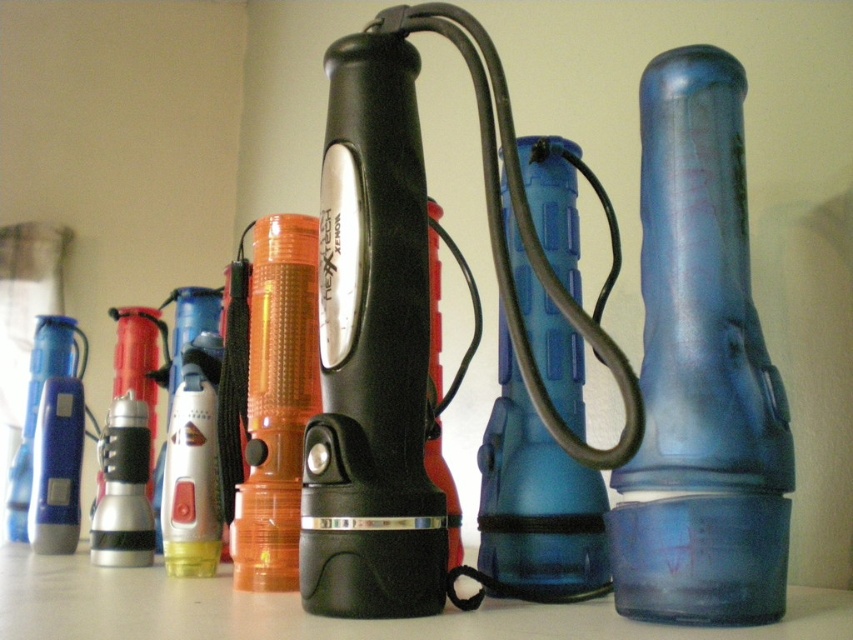
You are organizing a camping trip and need to choose between the transparent blue flashlight at right and the blue translucent bottle at center. Based on their sizes, which one would you pick for better visibility in the dark?

The transparent blue flashlight at right is larger in size than the blue translucent bottle at center, so it would provide better visibility in the dark.

You are standing in front of the flashlights and want to pick up the flashlight that is closer to you. Which point do you go to, point [714,564] or point [76,353]?

Point [714,564] is in front of point [76,353], so you should go to point [714,564] to pick up the closer flashlight.

What is the color of the flashlight located at point (700, 371)?

The transparent blue flashlight at right is located at point (700, 371).